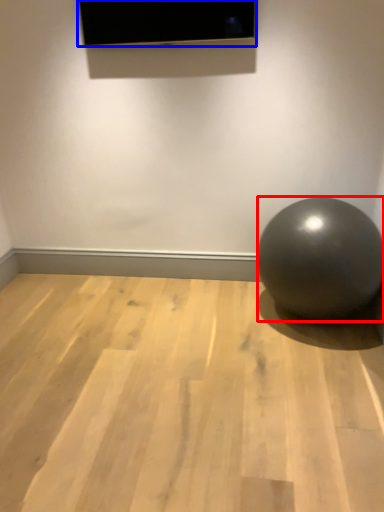
Question: Which object appears farthest to the camera in this image, ball (highlighted by a red box) or projection screen (highlighted by a blue box)?

Choices:
 (A) ball
 (B) projection screen

Answer: (B)